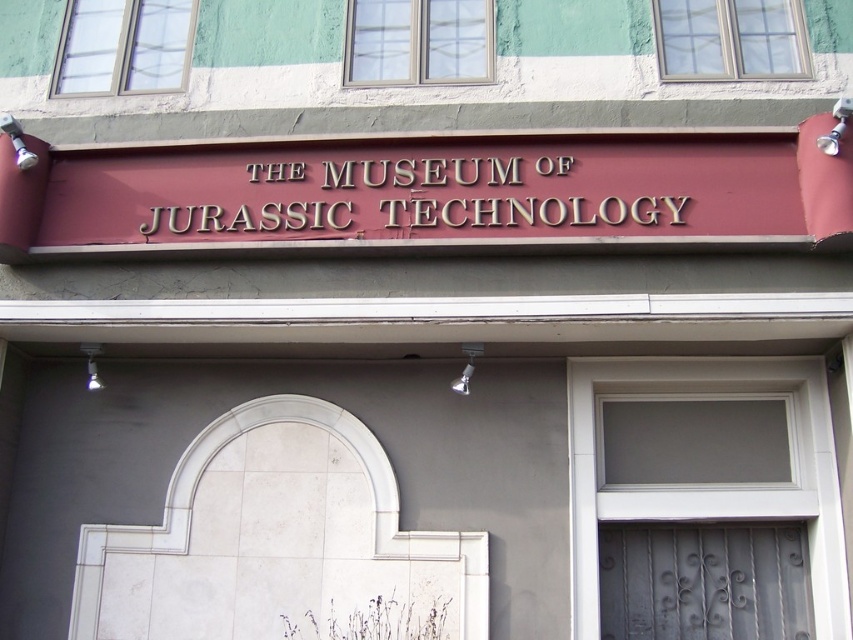
Is white glass door at center positioned at the back of matte gold sign at center?

That is True.

Who is positioned more to the left, white glass door at center or matte gold sign at center?

matte gold sign at center is more to the left.

Does point (828, 408) lie in front of point (355, 177)?

No, (828, 408) is further to viewer.

Where is `white glass door at center`? white glass door at center is located at coordinates (703, 483).